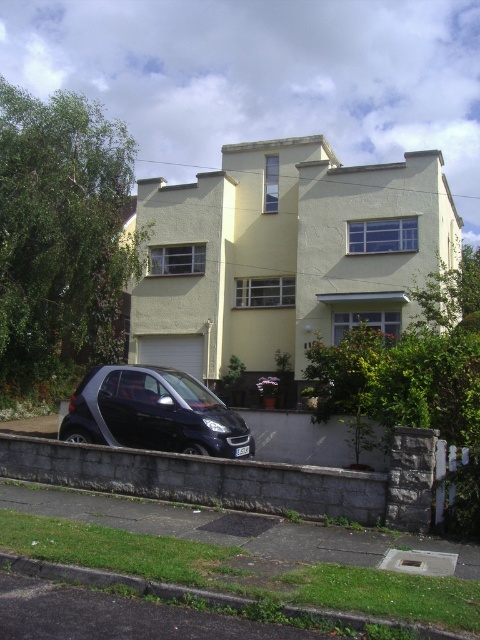
Question: Which of the following is the farthest from the observer?

Choices:
 (A) green grass at lower left
 (B) shiny black car at lower left

Answer: (B)

Question: Where is shiny black car at lower left located in relation to green grass at lower left in the image?

Choices:
 (A) left
 (B) right

Answer: (A)

Question: Does gray concrete curb at lower center lie behind green grass at lower left?

Choices:
 (A) yes
 (B) no

Answer: (A)

Question: Estimate the real-world distances between objects in this image. Which object is farther from the shiny black car at lower left?

Choices:
 (A) green grass at lower left
 (B) gray concrete curb at lower center

Answer: (A)

Question: Which object is the closest to the green grass at lower left?

Choices:
 (A) shiny black car at lower left
 (B) gray concrete curb at lower center

Answer: (B)

Question: Is shiny black car at lower left below green grass at lower left?

Choices:
 (A) no
 (B) yes

Answer: (A)